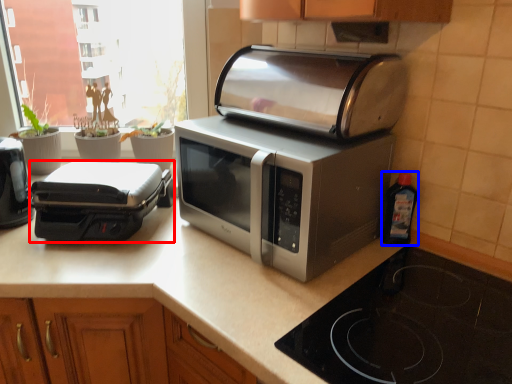
Question: Which point is closer to the camera, toaster (highlighted by a red box) or bottle (highlighted by a blue box)?

Choices:
 (A) toaster
 (B) bottle

Answer: (B)